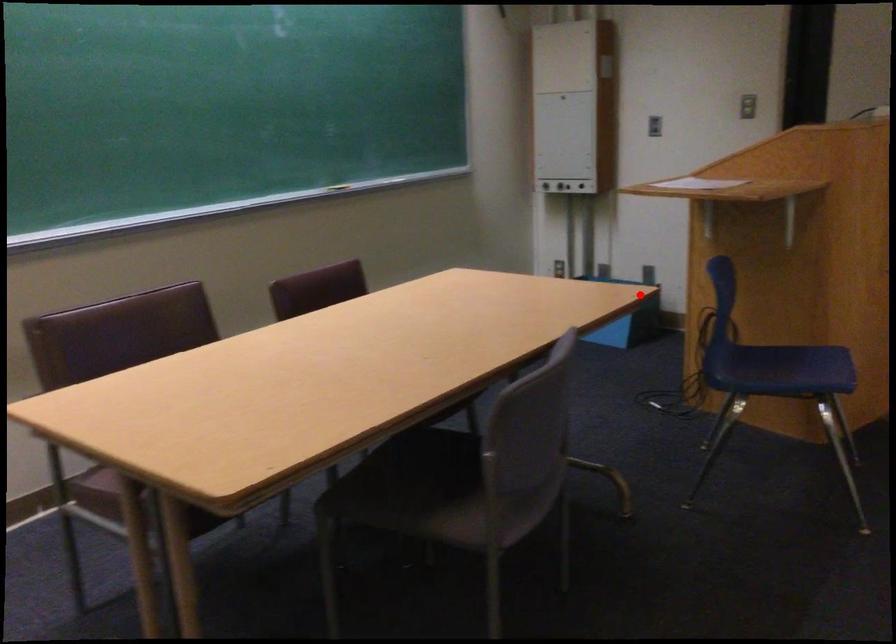
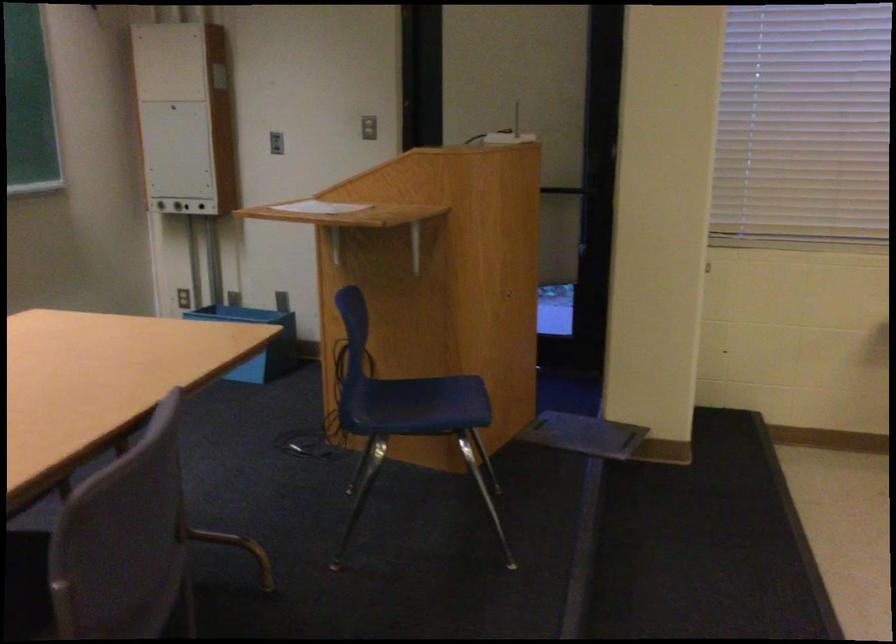
Question: I am providing you with two images of the same scene from different viewpoints. In image1, a red point is highlighted. Considering the same 3D point in image2, which of the following is correct?

Choices:
 (A) It is closer
 (B) It is farther

Answer: (A)